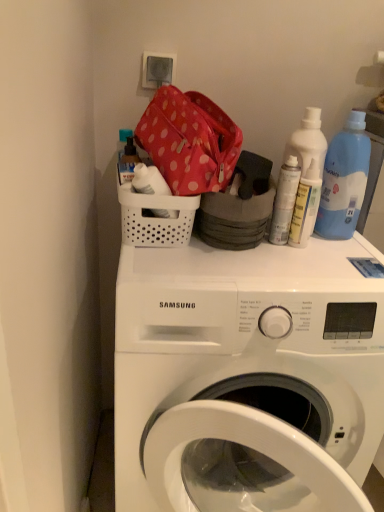
Question: In terms of height, does white matte spray can at upper right, placed as the second bottle when sorted from right to left, look taller or shorter compared to translucent plastic soap dispenser at upper left, arranged as the first bottle when viewed from the left?

Choices:
 (A) short
 (B) tall

Answer: (B)

Question: From the image's perspective, relative to translucent plastic soap dispenser at upper left, the 3th bottle when ordered from right to left, is white matte spray can at upper right, placed as the second bottle when sorted from right to left, above or below?

Choices:
 (A) above
 (B) below

Answer: (B)

Question: Based on their relative distances, which object is nearer to the polka dot fabric bag at upper center?

Choices:
 (A) white plastic basket at upper center
 (B) translucent plastic spray can at upper right, the 1th bottle positioned from the right
 (C) blue plastic bottle at upper right
 (D) white matte spray can at upper right, placed as the second bottle when sorted from right to left
 (E) translucent plastic soap dispenser at upper left, the 3th bottle when ordered from right to left

Answer: (A)

Question: Estimate the real-world distances between objects in this image. Which object is farther from the translucent plastic spray can at upper right, the third bottle positioned from the left?

Choices:
 (A) white plastic washing machine at upper center
 (B) white matte spray can at upper right, placed as the second bottle when sorted from right to left
 (C) blue plastic bottle at upper right
 (D) white plastic basket at upper center
 (E) translucent plastic soap dispenser at upper left, arranged as the first bottle when viewed from the left

Answer: (E)